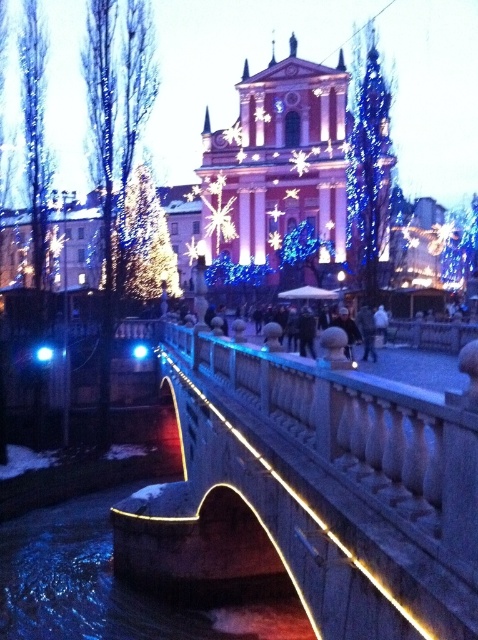
Looking at this image, you are standing at the coordinates where the image starts, and you want to reach the illuminated stone bridge at center. Which direction should you move in to reach it?

The illuminated stone bridge at center is located at point (312, 492), so you should move towards the center of the image to reach it.

You are a photographer planning to capture the reflection of the illuminated stone bridge at center in the water below. Based on the scene, can you confirm if the illuminated water at bridge center is positioned below the bridge to allow for a clear reflection?

Yes, the illuminated stone bridge at center is located above the illuminated water at bridge center, so the water is positioned directly beneath the bridge, making it possible to capture a clear reflection of the bridge in the water.